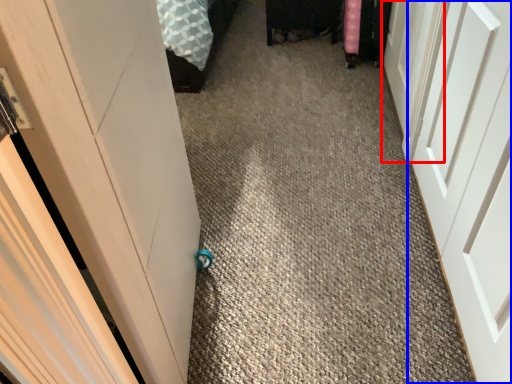
Question: Which object is further to the camera taking this photo, door (highlighted by a red box) or door (highlighted by a blue box)?

Choices:
 (A) door
 (B) door

Answer: (A)